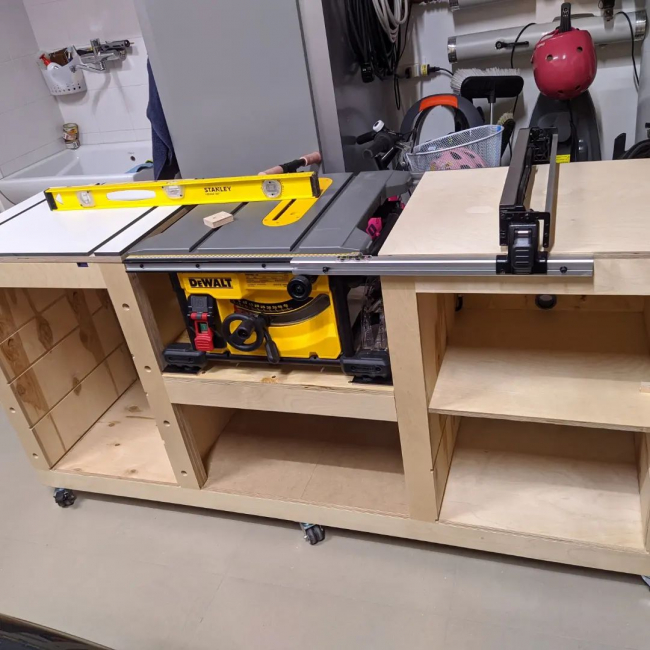
The height and width of the screenshot is (650, 650). In order to click on plug in this screenshot , I will do `click(424, 67)`.